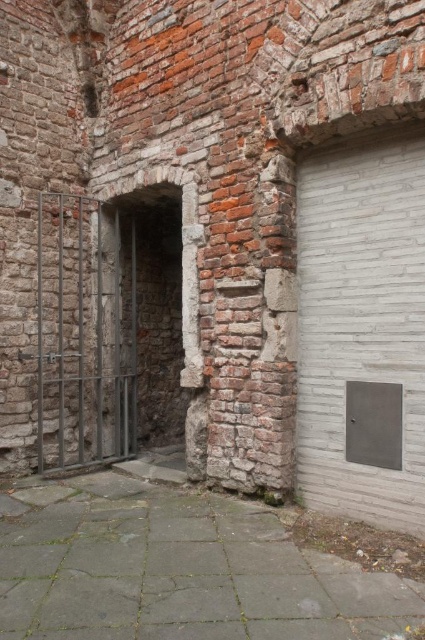
You are a delivery person trying to navigate a narrow alleyway. You see the gray concrete alley at center and the white matte garage door at right. Which path is wider for your delivery truck?

The gray concrete alley at center is wider than the white matte garage door at right, so the delivery truck should take the gray concrete alley at center.

You are a delivery robot with a width of 1.5 meters. You need to navigate through the gray concrete alley at center and pass by the metallic gate at left. Can you fit through the space between them?

The distance between the gray concrete alley at center and the metallic gate at left is 1.96 meters. Since your width is 1.5 meters, you can fit through the space between them as the distance is greater than your width.

You are standing in front of the building and want to enter through the doorway. The metallic gate at left is closed. Is the gray concrete alley at center accessible from your current position?

The gray concrete alley at center is located below the metallic gate at left, so yes, you can access the gray concrete alley at center by going around or under the metallic gate at left.